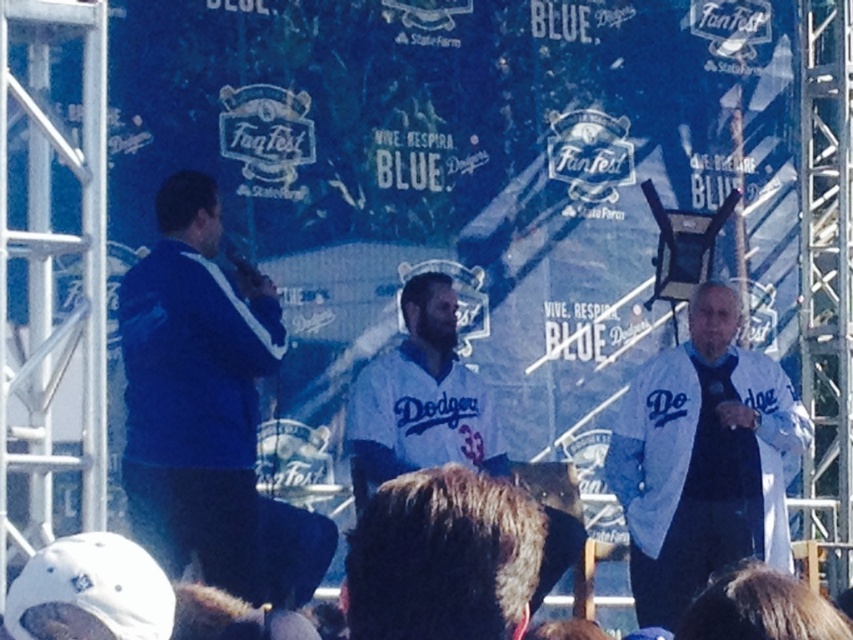
You are a photographer standing at the event. You want to take a closeup shot of the brown fur at center. Considering your camera can focus on objects within 30 meters, will you be able to capture it clearly?

The brown fur at center is 35.35 meters from the viewer, which is beyond the camera focus range of 30 meters. Therefore, the photographer cannot capture it clearly.